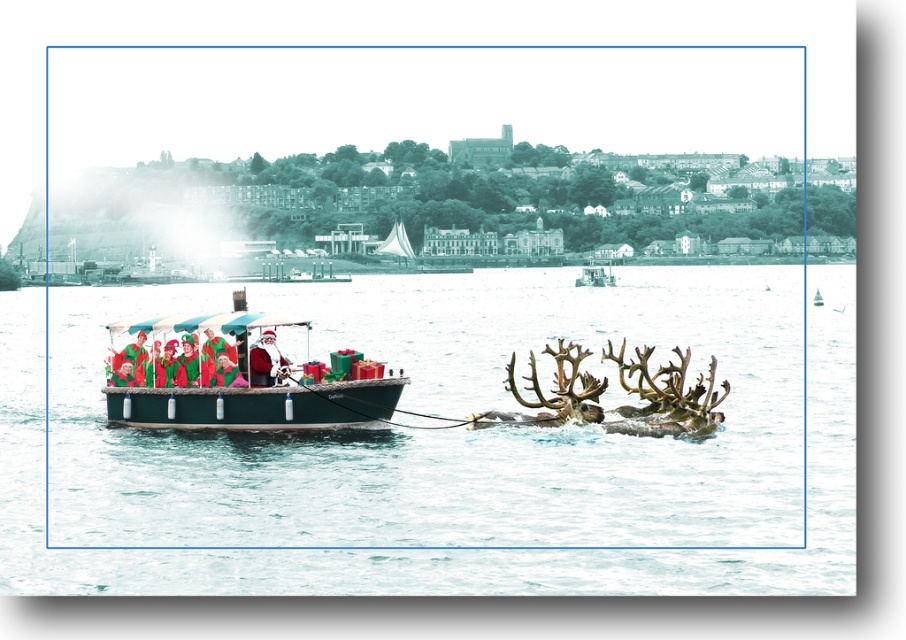
Question: Can you confirm if clear water at boat center is smaller than green matte boat at center?

Choices:
 (A) no
 (B) yes

Answer: (A)

Question: Does clear water at boat center have a smaller size compared to green matte boat at center?

Choices:
 (A) no
 (B) yes

Answer: (A)

Question: Among these objects, which one is farthest from the camera?

Choices:
 (A) clear water at boat center
 (B) green matte boat at center
 (C) metallic green boat at center

Answer: (C)

Question: Can you confirm if clear water at boat center is positioned to the right of green matte boat at center?

Choices:
 (A) yes
 (B) no

Answer: (B)

Question: Which object is the closest to the clear water at boat center?

Choices:
 (A) metallic green boat at center
 (B) green matte boat at center

Answer: (B)

Question: Estimate the real-world distances between objects in this image. Which object is closer to the green matte boat at center?

Choices:
 (A) metallic green boat at center
 (B) clear water at boat center

Answer: (B)